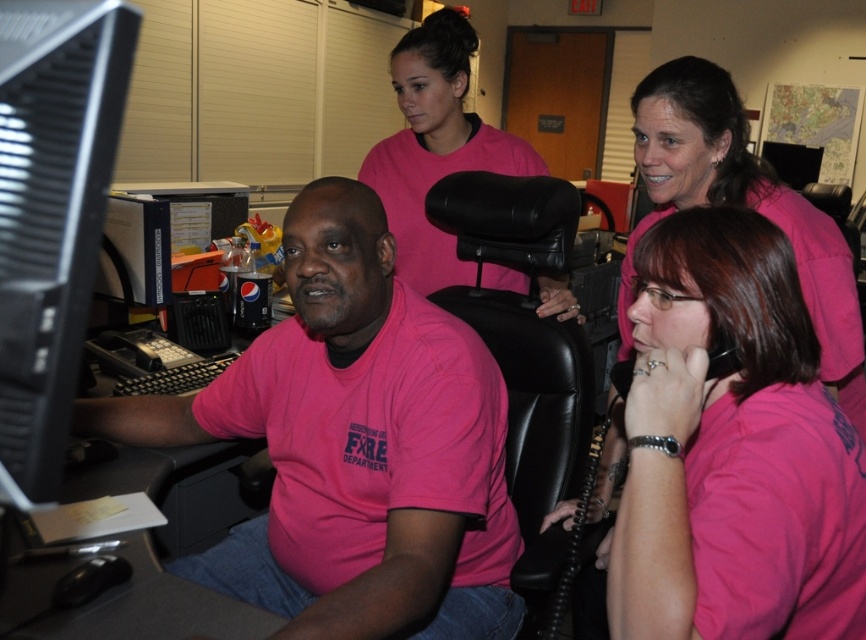
Question: Is black plastic monitor at left wider than pink matte shirt at upper right?

Choices:
 (A) no
 (B) yes

Answer: (A)

Question: Is the position of pink matte shirt at center more distant than that of pink matte shirt at upper right?

Choices:
 (A) yes
 (B) no

Answer: (B)

Question: Which point appears closest to the camera in this image?

Choices:
 (A) (658, 102)
 (B) (70, 320)
 (C) (550, 304)

Answer: (B)

Question: Is black leather swivel chair at center thinner than matte pink shirt at upper center?

Choices:
 (A) yes
 (B) no

Answer: (A)

Question: Which point appears farthest from the camera in this image?

Choices:
 (A) (635, 92)
 (B) (540, 188)
 (C) (408, 88)
 (D) (46, 12)

Answer: (C)

Question: Which of the following is the farthest from the observer?

Choices:
 (A) black plastic monitor at left
 (B) matte pink shirt at upper center
 (C) black leather swivel chair at center
 (D) pink matte shirt at upper right

Answer: (B)